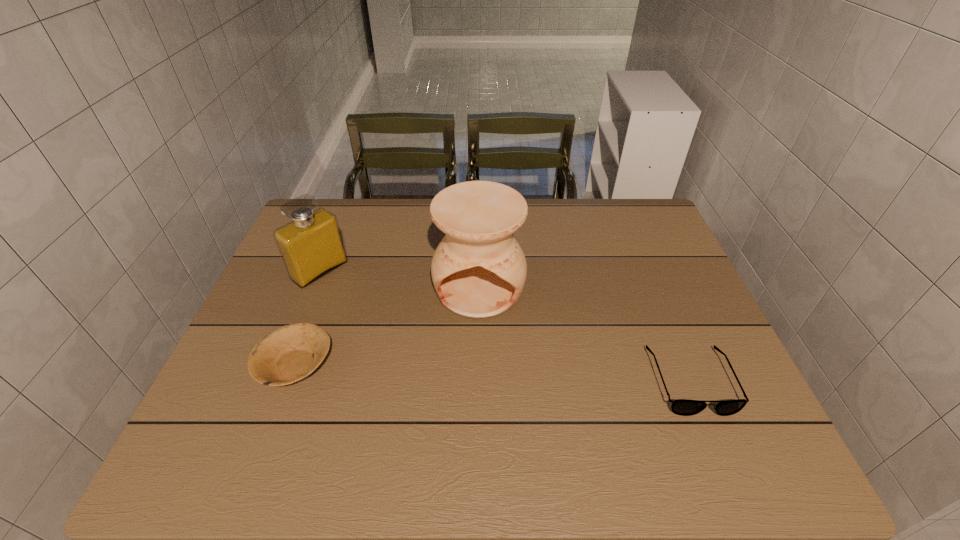
The image size is (960, 540). I want to click on bowl, so click(x=289, y=354).

Where is `spectacles`? The width and height of the screenshot is (960, 540). spectacles is located at coordinates (684, 407).

Image resolution: width=960 pixels, height=540 pixels. I want to click on the second object from right to left, so click(478, 270).

The image size is (960, 540). In order to click on perfume in this screenshot , I will do `click(311, 246)`.

Locate an element on the screen. free space located on the back of the bowl is located at coordinates (343, 239).

Locate an element on the screen. The width and height of the screenshot is (960, 540). free space located at the open side of the third object from left to right is located at coordinates (477, 346).

Find the location of a particular element. Image resolution: width=960 pixels, height=540 pixels. vacant space positioned 0.230m at the open side of the third object from left to right is located at coordinates (475, 400).

Locate an element on the screen. This screenshot has width=960, height=540. blank space located at the open side of the third object from left to right is located at coordinates (477, 346).

I want to click on free space located on the front-facing side of the perfume, so click(x=372, y=311).

Image resolution: width=960 pixels, height=540 pixels. Identify the location of vacant area situated on the front-facing side of the perfume. (396, 330).